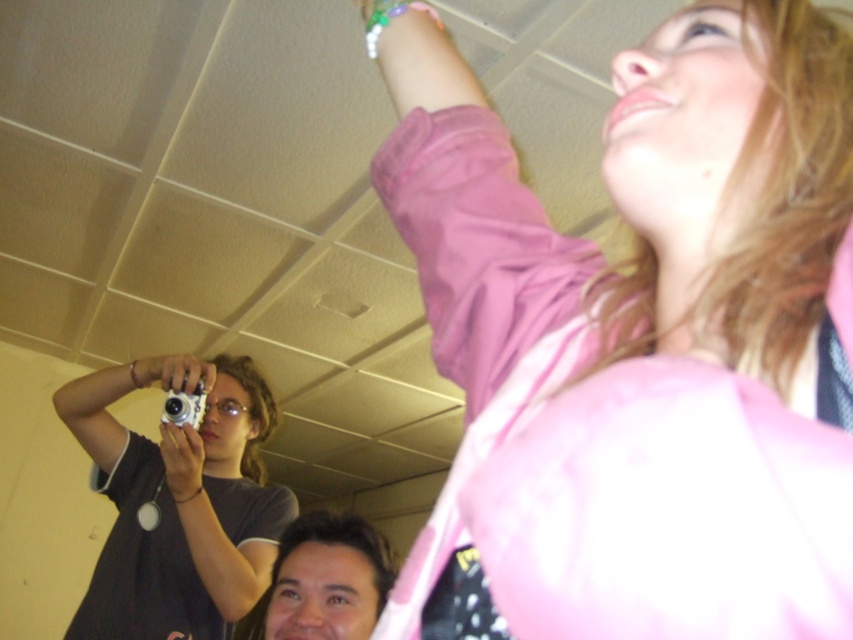
Who is taller, smooth brown hair at lower center or silver metallic camera at upper left?

smooth brown hair at lower center

This screenshot has height=640, width=853. Describe the element at coordinates (328, 579) in the screenshot. I see `smooth brown hair at lower center` at that location.

The image size is (853, 640). Identify the location of smooth brown hair at lower center. (328, 579).

Who is more forward, (743, 435) or (326, 604)?

Point (743, 435) is in front.

Locate an element on the screen. pink fabric at upper right is located at coordinates (637, 340).

Image resolution: width=853 pixels, height=640 pixels. What are the coordinates of `pink fabric at upper right` in the screenshot? It's located at (637, 340).

In the scene shown: Is pink fabric at upper right below silver metallic camera at upper left?

No, pink fabric at upper right is not below silver metallic camera at upper left.

Is pink fabric at upper right to the left of silver metallic camera at upper left from the viewer's perspective?

No, pink fabric at upper right is not to the left of silver metallic camera at upper left.

Image resolution: width=853 pixels, height=640 pixels. Find the location of `pink fabric at upper right`. pink fabric at upper right is located at coordinates (x=637, y=340).